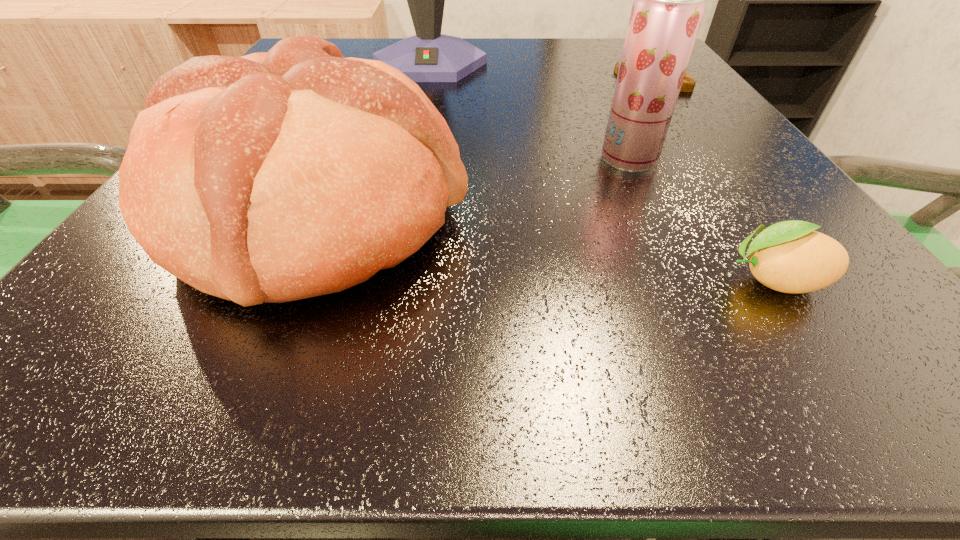
Identify the location of the tallest object. [x=429, y=56].

Identify the location of figurine. The width and height of the screenshot is (960, 540). (688, 84).

You are a GUI agent. You are given a task and a screenshot of the screen. Output one action in this format:
    pyautogui.click(x=<x>, y=<y>)
    Task: Click on the fruit juice
    This screenshot has width=960, height=540.
    Given the screenshot: What is the action you would take?
    pyautogui.click(x=669, y=0)

Locate an element on the screen. The height and width of the screenshot is (540, 960). bread is located at coordinates (276, 176).

Image resolution: width=960 pixels, height=540 pixels. What are the coordinates of `the shortest object` in the screenshot? It's located at (790, 257).

I want to click on free location located on the base of the lampshade, so click(414, 138).

Where is `vacant region located 0.060m on the front-facing side of the figurine`? The height and width of the screenshot is (540, 960). vacant region located 0.060m on the front-facing side of the figurine is located at coordinates (677, 109).

Where is `free spot located 0.280m on the front of the fruit juice`? free spot located 0.280m on the front of the fruit juice is located at coordinates (709, 333).

Locate an element on the screen. The width and height of the screenshot is (960, 540). free space located 0.200m on the back of the bread is located at coordinates (372, 89).

Find the location of a particular element. vacant space located with leaves positioned above the lemon is located at coordinates (478, 280).